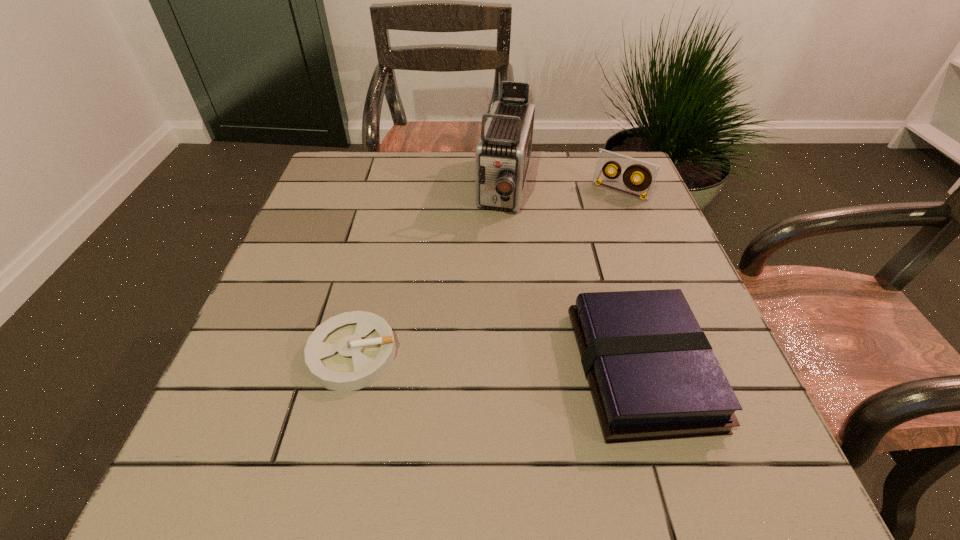
Find the location of a particular element. The width and height of the screenshot is (960, 540). vacant space that's between the book and the shortest object is located at coordinates (497, 361).

Where is `free space between the camcorder and the second shortest object`? free space between the camcorder and the second shortest object is located at coordinates (573, 279).

The width and height of the screenshot is (960, 540). What are the coordinates of `vacant area that lies between the videotape and the book` in the screenshot? It's located at (631, 280).

At what (x,y) coordinates should I click in order to perform the action: click on vacant region between the second object from left to right and the videotape. Please return your answer as a coordinate pair (x, y). Looking at the image, I should click on (563, 190).

The width and height of the screenshot is (960, 540). Identify the location of free space between the second tallest object and the camcorder. point(563,190).

Locate an element on the screen. Image resolution: width=960 pixels, height=540 pixels. vacant area between the videotape and the second shortest object is located at coordinates (631, 280).

At what (x,y) coordinates should I click in order to perform the action: click on free spot between the third object from right to left and the third shortest object. Please return your answer as a coordinate pair (x, y). Image resolution: width=960 pixels, height=540 pixels. Looking at the image, I should click on (563, 190).

Identify the location of free spot between the book and the third shortest object. Image resolution: width=960 pixels, height=540 pixels. (631, 280).

You are a GUI agent. You are given a task and a screenshot of the screen. Output one action in this format:
    pyautogui.click(x=<x>, y=<y>)
    Task: Click on the empty space between the videotape and the tallest object
    This screenshot has width=960, height=540.
    Given the screenshot: What is the action you would take?
    pyautogui.click(x=563, y=190)

Locate an element on the screen. This screenshot has width=960, height=540. object that is the second nearest to the leftmost object is located at coordinates (652, 373).